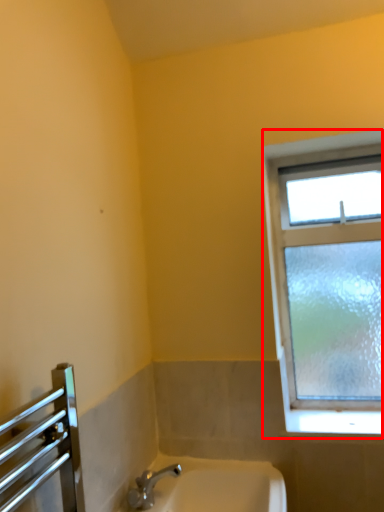
Question: From the image's perspective, what is the correct spatial positioning of window (annotated by the red box) in reference to sink?

Choices:
 (A) above
 (B) below

Answer: (A)